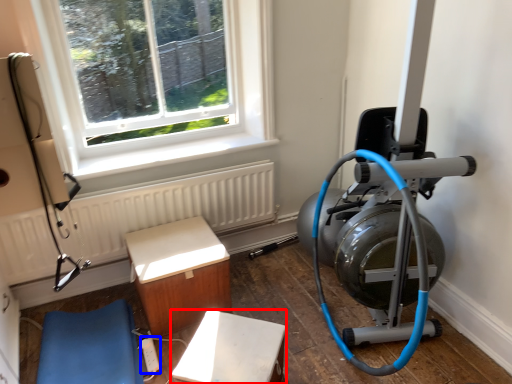
Question: Which object appears closest to the camera in this image, furniture (highlighted by a red box) or extension cord (highlighted by a blue box)?

Choices:
 (A) furniture
 (B) extension cord

Answer: (A)